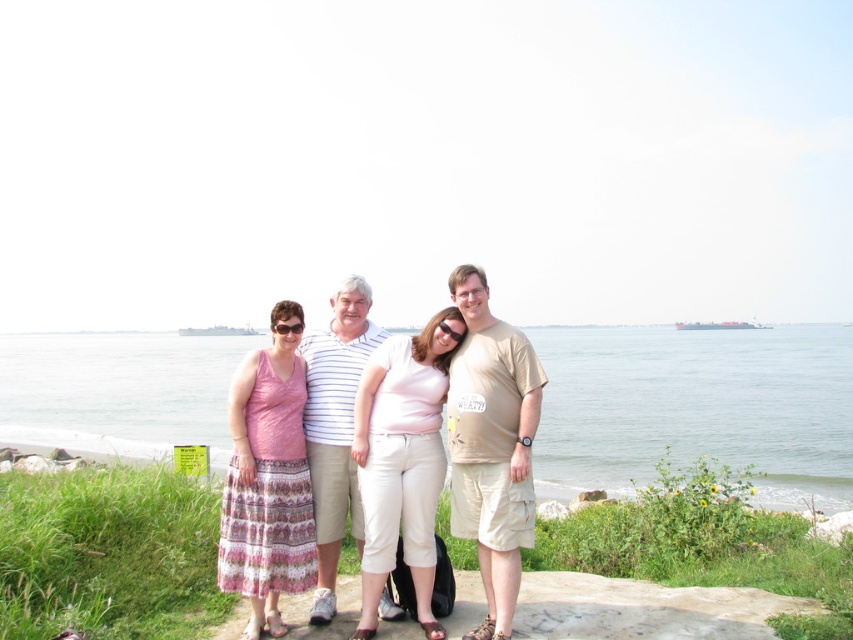
Question: Which point is farther from the camera taking this photo?

Choices:
 (A) (287, 420)
 (B) (483, 513)
 (C) (332, 404)

Answer: (C)

Question: Which point is farther to the camera?

Choices:
 (A) striped cotton shirt at center
 (B) blue water at center
 (C) matte pink shirt at center
 (D) tan cotton t-shirt at center

Answer: (B)

Question: Estimate the real-world distances between objects in this image. Which object is farther from the matte pink shirt at center?

Choices:
 (A) pink printed dress at left
 (B) striped cotton shirt at center
 (C) tan cotton t-shirt at center

Answer: (A)

Question: Does matte pink shirt at center appear on the left side of striped cotton shirt at center?

Choices:
 (A) no
 (B) yes

Answer: (A)

Question: Is tan cotton t-shirt at center to the right of striped cotton shirt at center from the viewer's perspective?

Choices:
 (A) yes
 (B) no

Answer: (A)

Question: Does blue water at center appear on the right side of matte pink shirt at center?

Choices:
 (A) yes
 (B) no

Answer: (B)